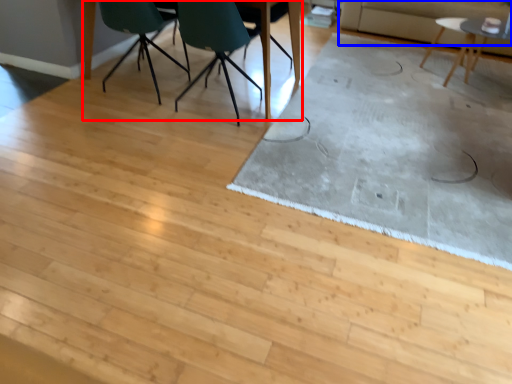
Question: Which of the following is the farthest to the observer, table (highlighted by a red box) or couch (highlighted by a blue box)?

Choices:
 (A) table
 (B) couch

Answer: (B)